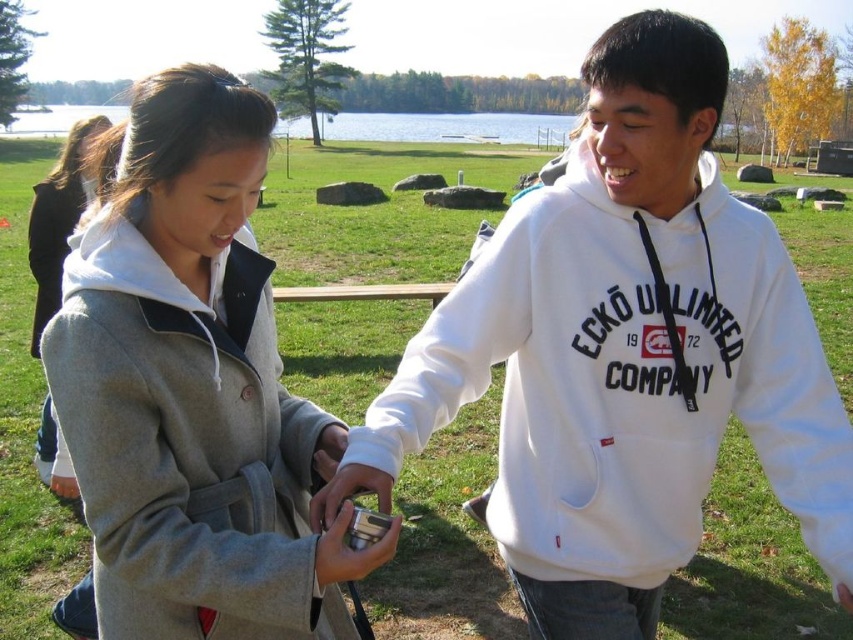
Can you confirm if gray wool coat at center is smaller than light gray wool coat at center?

Yes, gray wool coat at center is smaller than light gray wool coat at center.

Who is shorter, gray wool coat at center or light gray wool coat at center?

gray wool coat at center

Where is `gray wool coat at center`? gray wool coat at center is located at coordinates (186, 371).

This screenshot has width=853, height=640. What are the coordinates of `gray wool coat at center` in the screenshot? It's located at (186, 371).

Is the position of white fleece hoodie at center less distant than that of light gray wool coat at center?

Yes, white fleece hoodie at center is in front of light gray wool coat at center.

Which of these two, white fleece hoodie at center or light gray wool coat at center, stands taller?

light gray wool coat at center

Between point (440, 353) and point (51, 474), which one is positioned in front?

Positioned in front is point (440, 353).

What are the coordinates of `white fleece hoodie at center` in the screenshot? It's located at (624, 355).

Who is higher up, light gray wool coat at center or metallic silver camera at center?

light gray wool coat at center is higher up.

Can you confirm if light gray wool coat at center is taller than metallic silver camera at center?

Correct, light gray wool coat at center is much taller as metallic silver camera at center.

Does point (36, 301) come closer to viewer compared to point (337, 538)?

No, (36, 301) is behind (337, 538).

You are a GUI agent. You are given a task and a screenshot of the screen. Output one action in this format:
    pyautogui.click(x=<x>, y=<y>)
    Task: Click on the light gray wool coat at center
    This screenshot has height=640, width=853.
    Given the screenshot: What is the action you would take?
    pyautogui.click(x=59, y=216)